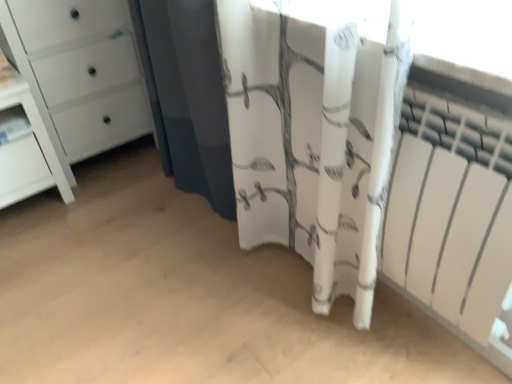
This screenshot has width=512, height=384. Describe the element at coordinates (13, 124) in the screenshot. I see `white glossy bookshelf at left` at that location.

At what (x,y) coordinates should I click in order to perform the action: click on white floral fabric at center. Please return your answer as a coordinate pair (x, y). Looking at the image, I should click on click(190, 98).

Locate an element on the screen. white fabric curtain at center is located at coordinates point(314,136).

This screenshot has height=384, width=512. What do you see at coordinates (314, 136) in the screenshot? I see `white fabric curtain at center` at bounding box center [314, 136].

Locate an element on the screen. The image size is (512, 384). white glossy chest of drawers at left is located at coordinates (84, 71).

Where is `white matte radiator at right`? This screenshot has height=384, width=512. white matte radiator at right is located at coordinates (453, 201).

Looking at this image, does white floral fabric at center have a lesser width compared to white fabric curtain at center?

Indeed, white floral fabric at center has a lesser width compared to white fabric curtain at center.

Between white floral fabric at center and white fabric curtain at center, which one appears on the right side from the viewer's perspective?

white fabric curtain at center is more to the right.

How distant is white floral fabric at center from white fabric curtain at center?

white floral fabric at center is 14.58 inches from white fabric curtain at center.

Can you confirm if white floral fabric at center is smaller than white fabric curtain at center?

Correct, white floral fabric at center occupies less space than white fabric curtain at center.

Find the location of a particular element. The image size is (512, 384). curtain located on the left of white matte radiator at right is located at coordinates (314, 136).

Are white matte radiator at right and white fabric curtain at center making contact?

No, white matte radiator at right is not making contact with white fabric curtain at center.

From a real-world perspective, between white matte radiator at right and white fabric curtain at center, who is vertically higher?

white fabric curtain at center is physically above.

From the image's perspective, which one is positioned lower, white matte radiator at right or white fabric curtain at center?

From the image's view, white matte radiator at right is below.

How different are the orientations of white matte radiator at right and white glossy bookshelf at left in degrees?

91.9 degrees.

Based on their sizes in the image, would you say white matte radiator at right is bigger or smaller than white glossy bookshelf at left?

white matte radiator at right is bigger than white glossy bookshelf at left.

Considering the sizes of objects white matte radiator at right and white glossy bookshelf at left in the image provided, who is thinner, white matte radiator at right or white glossy bookshelf at left?

With smaller width is white matte radiator at right.

Does white matte radiator at right turn towards white glossy chest of drawers at left?

No, white matte radiator at right does not turn towards white glossy chest of drawers at left.

Which of these two, white matte radiator at right or white glossy chest of drawers at left, is wider?

white glossy chest of drawers at left is wider.

Considering the positions of point (433, 276) and point (101, 123), is point (433, 276) closer or farther from the camera than point (101, 123)?

Clearly, point (433, 276) is closer to the camera than point (101, 123).

From the image's perspective, which one is positioned higher, white matte radiator at right or white glossy chest of drawers at left?

white glossy chest of drawers at left appears higher in the image.

Which point is more distant from viewer, (326, 272) or (87, 28)?

Positioned behind is point (87, 28).

From a real-world perspective, is white fabric curtain at center below white glossy chest of drawers at left?

Incorrect, from a real-world perspective, white fabric curtain at center is higher than white glossy chest of drawers at left.

From the picture: Looking at their sizes, would you say white fabric curtain at center is wider or thinner than white glossy chest of drawers at left?

In the image, white fabric curtain at center appears to be more narrow than white glossy chest of drawers at left.

Is white glossy bookshelf at left completely or partially outside of white matte radiator at right?

white glossy bookshelf at left is positioned outside white matte radiator at right.

Considering the relative sizes of white glossy bookshelf at left and white matte radiator at right in the image provided, is white glossy bookshelf at left shorter than white matte radiator at right?

Yes.

Considering the relative positions of white glossy bookshelf at left and white matte radiator at right in the image provided, is white glossy bookshelf at left to the left or to the right of white matte radiator at right?

white glossy bookshelf at left is positioned on white matte radiator at right's left side.

There is a white glossy bookshelf at left. Identify the location of the chest of drawers above it (from a real-world perspective). (84, 71).

Is white glossy chest of drawers at left positioned in front of white glossy bookshelf at left?

Yes, white glossy chest of drawers at left is closer to the viewer.

From the image's perspective, is white glossy chest of drawers at left positioned above or below white glossy bookshelf at left?

white glossy chest of drawers at left is above white glossy bookshelf at left.

From a real-world perspective, which is physically above, white glossy chest of drawers at left or white glossy bookshelf at left?

white glossy chest of drawers at left.

The image size is (512, 384). What are the coordinates of `curtain lying below the white floral fabric at center (from the image's perspective)` in the screenshot? It's located at (314, 136).

Where is `curtain located above the white matte radiator at right (from the image's perspective)`? Image resolution: width=512 pixels, height=384 pixels. curtain located above the white matte radiator at right (from the image's perspective) is located at coordinates (314, 136).

Looking at the image, which one is located closer to white fabric curtain at center, white glossy chest of drawers at left or white matte radiator at right?

white matte radiator at right lies closer to white fabric curtain at center than the other object.

Considering their positions, is white glossy bookshelf at left positioned further to white fabric curtain at center than white floral fabric at center?

Based on the image, white glossy bookshelf at left appears to be further to white fabric curtain at center.

Estimate the real-world distances between objects in this image. Which object is further from white glossy bookshelf at left, white fabric curtain at center or white floral fabric at center?

white fabric curtain at center is further to white glossy bookshelf at left.

From the image, which object appears to be farther from white matte radiator at right, white glossy chest of drawers at left or white glossy bookshelf at left?

white glossy bookshelf at left lies further to white matte radiator at right than the other object.

From the image, which object appears to be nearer to white glossy chest of drawers at left, white fabric curtain at center or white floral fabric at center?

Among the two, white floral fabric at center is located nearer to white glossy chest of drawers at left.

When comparing their distances from white matte radiator at right, does white fabric curtain at center or white glossy chest of drawers at left seem closer?

white fabric curtain at center lies closer to white matte radiator at right than the other object.

Considering their positions, is white floral fabric at center positioned further to white glossy chest of drawers at left than white fabric curtain at center?

Among the two, white fabric curtain at center is located further to white glossy chest of drawers at left.

Based on their spatial positions, is white glossy bookshelf at left or white floral fabric at center closer to white matte radiator at right?

white floral fabric at center.

Locate an element on the screen. The width and height of the screenshot is (512, 384). curtain between white glossy bookshelf at left and white matte radiator at right from left to right is located at coordinates (314, 136).

Find the location of a particular element. The image size is (512, 384). curtain between white glossy chest of drawers at left and white matte radiator at right is located at coordinates (314, 136).

Find the location of a particular element. shower curtain situated between white glossy bookshelf at left and white matte radiator at right from left to right is located at coordinates (190, 98).

Image resolution: width=512 pixels, height=384 pixels. In order to click on the chest of drawers located between white glossy bookshelf at left and white floral fabric at center in the left-right direction in this screenshot , I will do pyautogui.click(x=84, y=71).